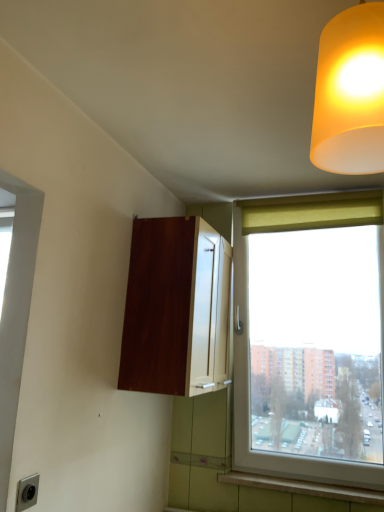
Question: From their relative heights in the image, would you say matte yellow lampshade at upper right is taller or shorter than matte gray electric outlet at lower left?

Choices:
 (A) short
 (B) tall

Answer: (B)

Question: Is matte yellow lampshade at upper right to the left or to the right of matte gray electric outlet at lower left in the image?

Choices:
 (A) left
 (B) right

Answer: (B)

Question: Considering the real-world distances, which object is farthest from the mahogany wood cabinet at center?

Choices:
 (A) wooden window sill at lower right
 (B) matte yellow curtain at upper right
 (C) matte yellow lampshade at upper right
 (D) matte gray electric outlet at lower left

Answer: (C)

Question: Based on their relative distances, which object is nearer to the wooden window sill at lower right?

Choices:
 (A) matte yellow lampshade at upper right
 (B) matte yellow curtain at upper right
 (C) matte gray electric outlet at lower left
 (D) mahogany wood cabinet at center

Answer: (D)